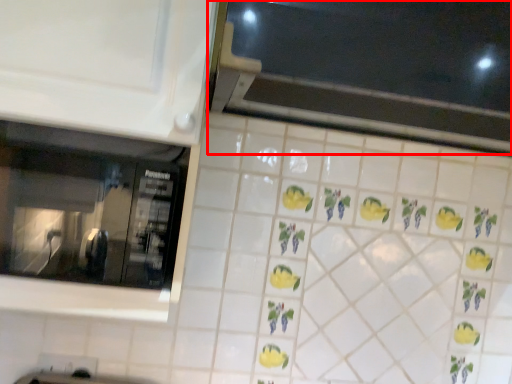
Question: Considering the relative positions of window (annotated by the red box) and window in the image provided, where is window (annotated by the red box) located with respect to the staircase?

Choices:
 (A) left
 (B) right

Answer: (B)